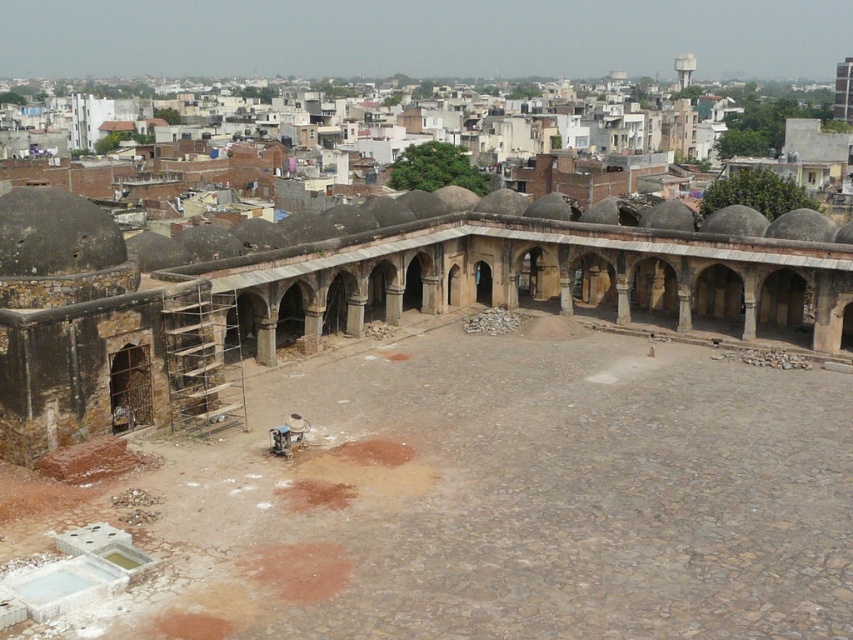
Question: Among these objects, which one is nearest to the camera?

Choices:
 (A) brown stone courtyard at center
 (B) stone paved courtyard at center

Answer: (B)

Question: Where is stone paved courtyard at center located in relation to brown stone courtyard at center in the image?

Choices:
 (A) above
 (B) below

Answer: (B)

Question: Which point appears closest to the camera in this image?

Choices:
 (A) (334, 400)
 (B) (515, 301)

Answer: (A)

Question: Does stone paved courtyard at center lie in front of brown stone courtyard at center?

Choices:
 (A) no
 (B) yes

Answer: (B)

Question: In this image, where is stone paved courtyard at center located relative to brown stone courtyard at center?

Choices:
 (A) below
 (B) above

Answer: (A)

Question: Which object appears closest to the camera in this image?

Choices:
 (A) brown stone courtyard at center
 (B) stone paved courtyard at center

Answer: (B)